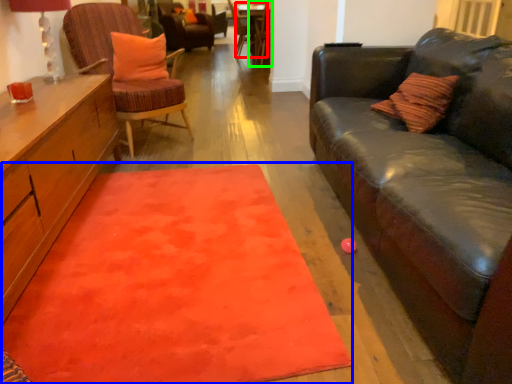
Question: Which object is the closest to the side table (highlighted by a red box)? Choose among these: mat (highlighted by a blue box) or chair (highlighted by a green box).

Choices:
 (A) mat
 (B) chair

Answer: (B)